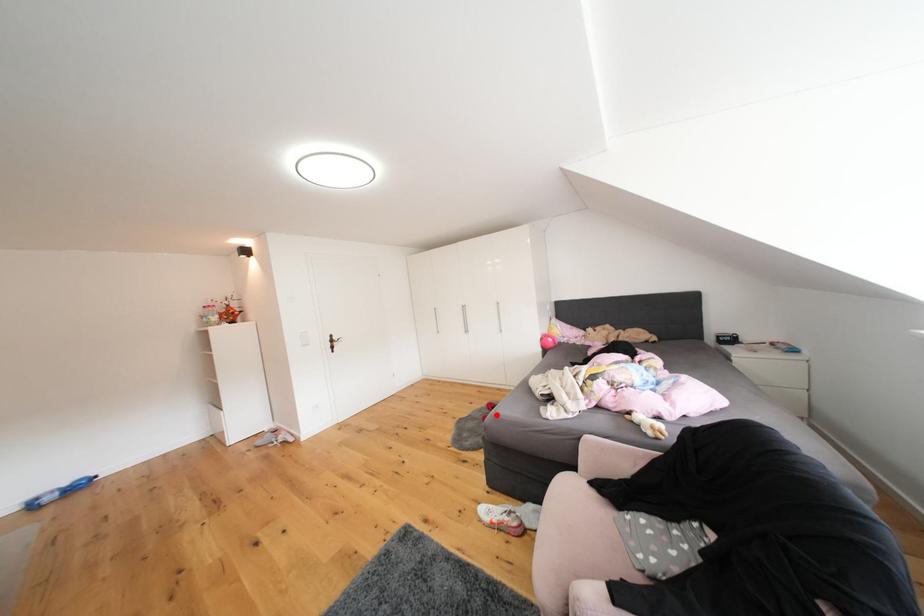
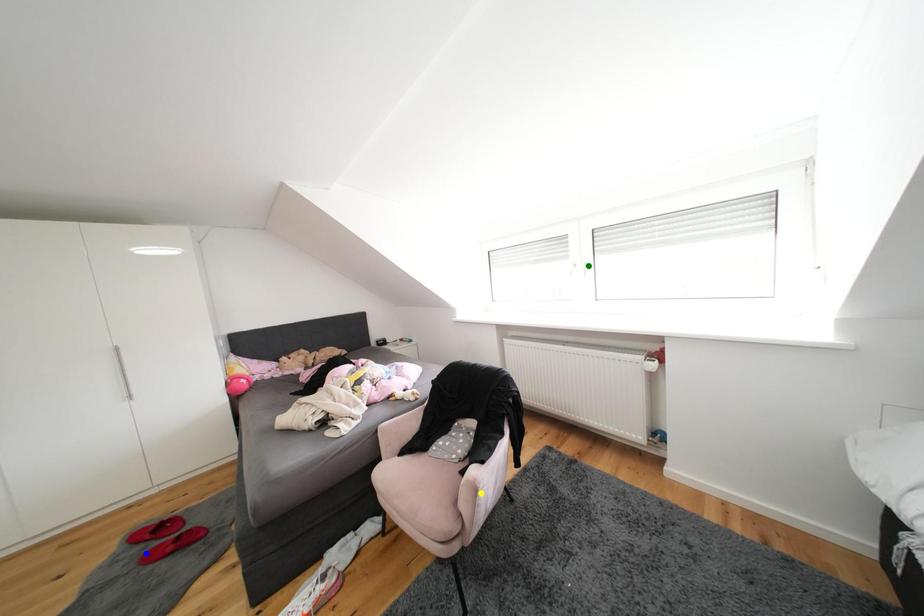
Question: I am providing you with two images of the same scene from different viewpoints. A red point is marked on the first image. You are given multiple points on the second image. Which mark in image 2 goes with the point in image 1?

Choices:
 (A) yellow point
 (B) green point
 (C) blue point

Answer: (C)